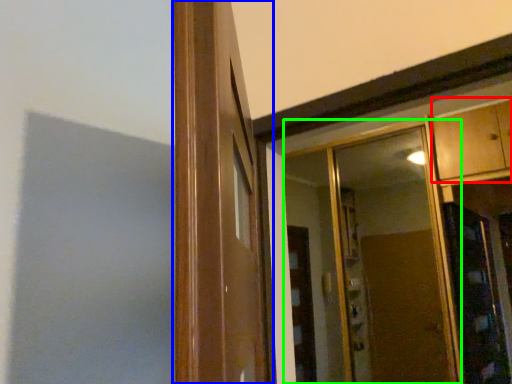
Question: Which is nearer to the cabinetry (highlighted by a red box)? window frame (highlighted by a blue box) or mirror (highlighted by a green box).

Choices:
 (A) window frame
 (B) mirror

Answer: (B)